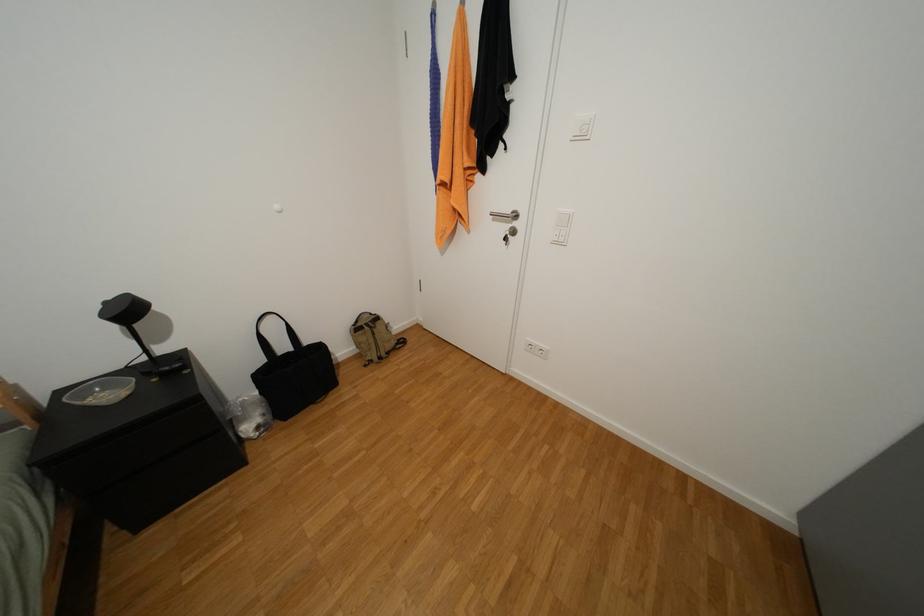
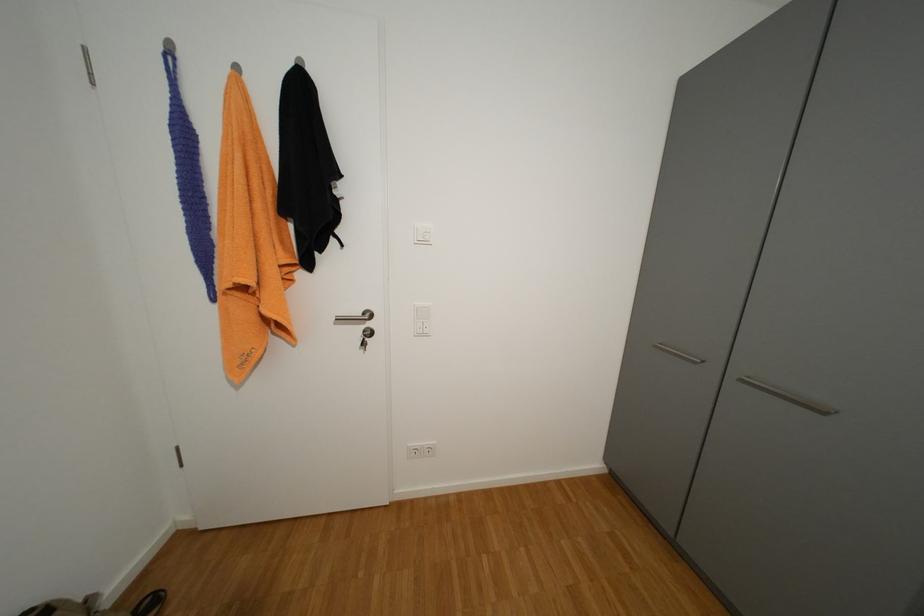
Question: The camera is either moving clockwise (left) or counter-clockwise (right) around the object. The first image is from the beginning of the video and the second image is from the end. Is the camera moving left or right when shooting the video?

Choices:
 (A) Left
 (B) Right

Answer: (A)